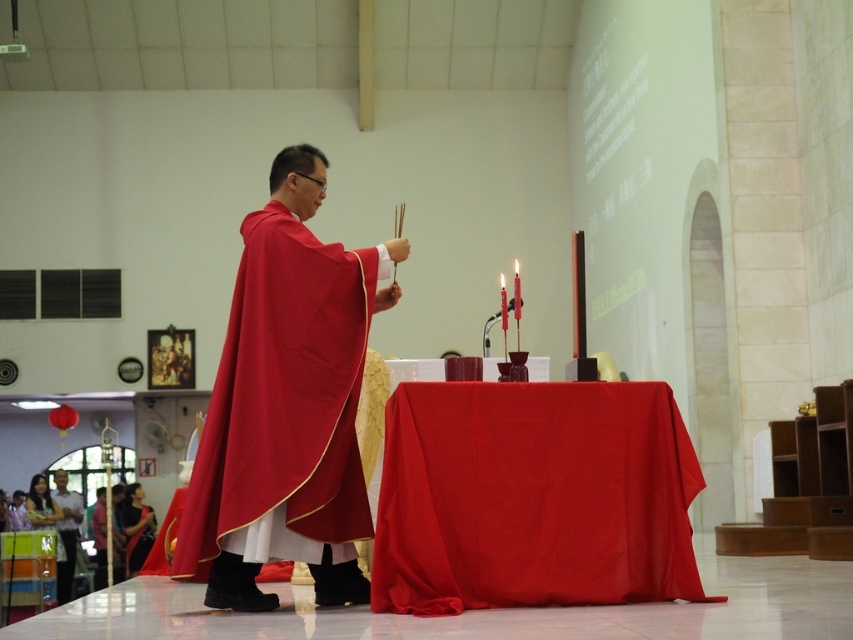
Does red cloth table at center appear on the left side of smooth white shirt at lower left?

No, red cloth table at center is not to the left of smooth white shirt at lower left.

Does red cloth table at center appear under smooth white shirt at lower left?

Incorrect, red cloth table at center is not positioned below smooth white shirt at lower left.

Which is behind, point (563, 490) or point (62, 506)?

Point (62, 506)

The width and height of the screenshot is (853, 640). I want to click on red cloth table at center, so click(x=532, y=497).

How distant is smooth white shirt at lower left from satin black dress at lower left?

They are 1.42 meters apart.

Who is positioned more to the right, smooth white shirt at lower left or satin black dress at lower left?

satin black dress at lower left is more to the right.

Locate an element on the screen. The image size is (853, 640). smooth white shirt at lower left is located at coordinates (67, 532).

Who is shorter, matte red cape at center or smooth white shirt at lower left?

smooth white shirt at lower left is shorter.

The width and height of the screenshot is (853, 640). In order to click on matte red cape at center in this screenshot , I will do `click(283, 396)`.

Locate an element on the screen. This screenshot has height=640, width=853. matte red cape at center is located at coordinates (283, 396).